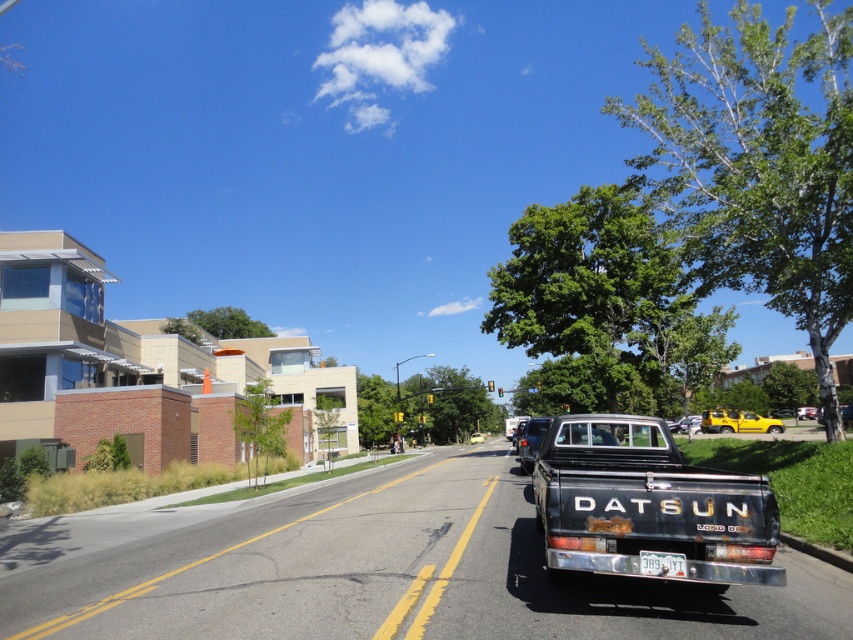
Between yellow matte pickup truck at center and white plastic license plate at center, which one has less height?

Standing shorter between the two is white plastic license plate at center.

Between yellow matte pickup truck at center and white plastic license plate at center, which one is positioned higher?

Positioned higher is white plastic license plate at center.

Is point (701, 413) closer to viewer compared to point (645, 550)?

No, it is behind (645, 550).

At what (x,y) coordinates should I click in order to perform the action: click on yellow matte pickup truck at center. Please return your answer as a coordinate pair (x, y). Image resolution: width=853 pixels, height=640 pixels. Looking at the image, I should click on (738, 420).

Can you confirm if white plastic license plate at center is smaller than metallic silver truck at center?

Indeed, white plastic license plate at center has a smaller size compared to metallic silver truck at center.

Which is behind, point (645, 563) or point (810, 413)?

Positioned behind is point (810, 413).

Which is behind, point (657, 572) or point (807, 416)?

Positioned behind is point (807, 416).

The height and width of the screenshot is (640, 853). Find the location of `white plastic license plate at center`. white plastic license plate at center is located at coordinates (662, 563).

Can you confirm if yellow matte pickup truck at center is taller than metallic silver car at center?

No, yellow matte pickup truck at center is not taller than metallic silver car at center.

In the scene shown: Between yellow matte pickup truck at center and metallic silver car at center, which one has more height?

Standing taller between the two is metallic silver car at center.

Locate an element on the screen. yellow matte pickup truck at center is located at coordinates (738, 420).